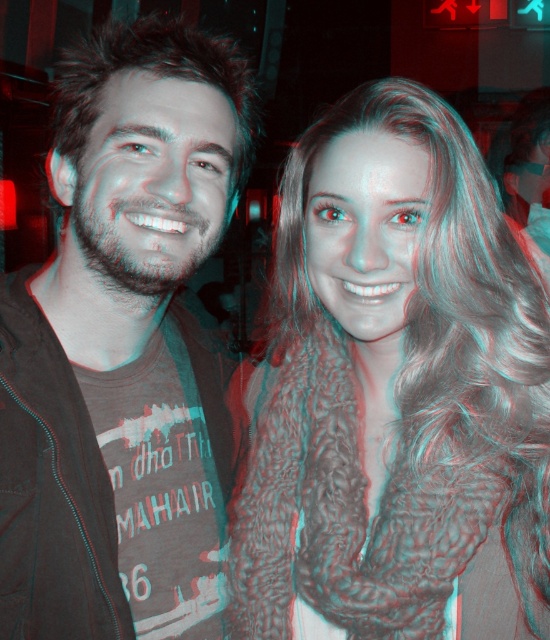
Question: Which of the following is the farthest from the observer?

Choices:
 (A) (41, 616)
 (B) (528, 440)

Answer: (A)

Question: Can you confirm if fuzzy brown scarf at center is positioned to the right of dark gray t-shirt at center?

Choices:
 (A) no
 (B) yes

Answer: (B)

Question: Which of the following is the farthest from the observer?

Choices:
 (A) (101, 522)
 (B) (371, 492)

Answer: (A)

Question: Does fuzzy brown scarf at center have a greater width compared to dark gray t-shirt at center?

Choices:
 (A) no
 (B) yes

Answer: (B)

Question: Is fuzzy brown scarf at center above dark gray t-shirt at center?

Choices:
 (A) no
 (B) yes

Answer: (A)